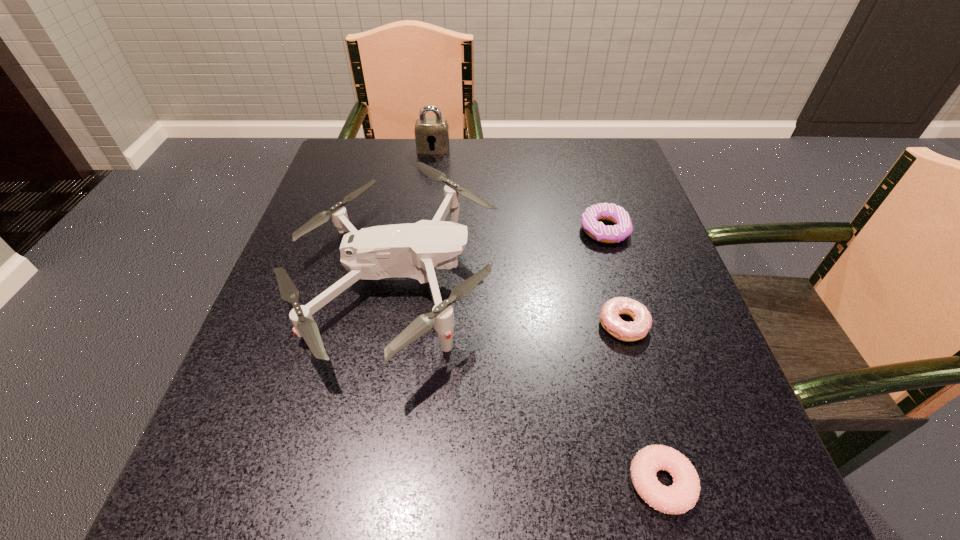
Identify the location of vacant space at the near left corner. (252, 487).

In the image, there is a desktop. Identify the location of free space at the far right corner. (605, 179).

The height and width of the screenshot is (540, 960). Identify the location of free spot between the tallest doughnut and the padlock. (519, 190).

Image resolution: width=960 pixels, height=540 pixels. In order to click on vacant space that is in between the nearest object and the second nearest doughnut in this screenshot , I will do `click(642, 403)`.

Where is `free point between the second nearest doughnut and the third shortest object`? The width and height of the screenshot is (960, 540). free point between the second nearest doughnut and the third shortest object is located at coordinates (613, 278).

This screenshot has height=540, width=960. What are the coordinates of `free space between the farthest doughnut and the drone` in the screenshot? It's located at (499, 257).

Locate an element on the screen. This screenshot has width=960, height=540. empty space that is in between the drone and the second nearest doughnut is located at coordinates (509, 304).

Find the location of a particular element. The height and width of the screenshot is (540, 960). blank region between the nearest object and the farthest object is located at coordinates (547, 316).

You are a GUI agent. You are given a task and a screenshot of the screen. Output one action in this format:
    pyautogui.click(x=<x>, y=<y>)
    Task: Click on the free point between the drone and the second nearest doughnut
    Image resolution: width=960 pixels, height=540 pixels.
    Given the screenshot: What is the action you would take?
    pyautogui.click(x=509, y=304)

I want to click on empty space that is in between the drone and the nearest object, so click(528, 383).